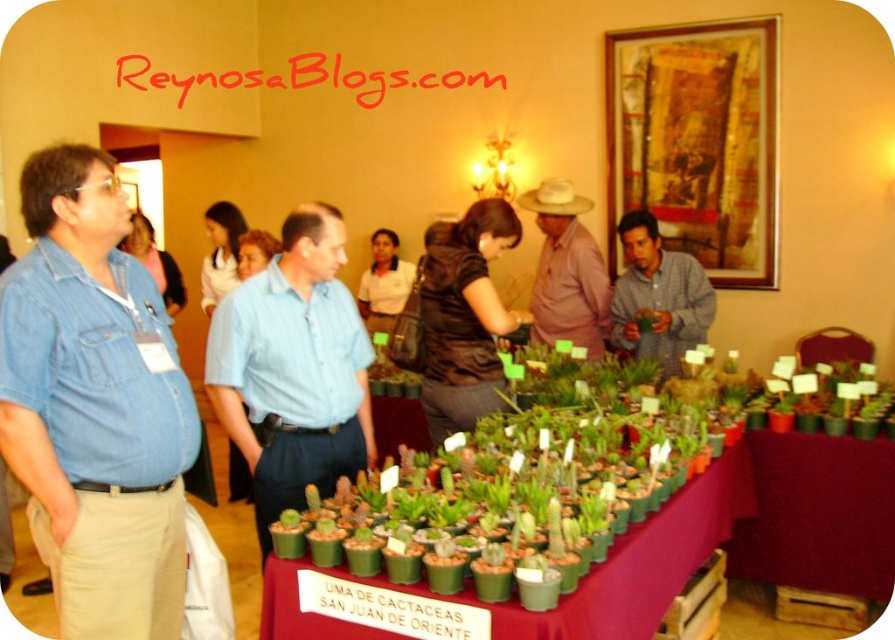
You are organizing a small event and need to place a decorative item on the maroon fabric table at lower right and the pink cotton shirt at center. Considering their sizes, which object might require a larger surface area to accommodate it properly?

The pink cotton shirt at center requires a larger surface area because the maroon fabric table at lower right has a smaller size compared to it.

You are standing at the entrance of the botanical exhibition and want to locate the person wearing the light blue shirt at center. Based on the coordinates provided, in which direction should you look to find them?

The light blue shirt at center is located at coordinates point (293, 369), so you should look towards the center of the room to find them.